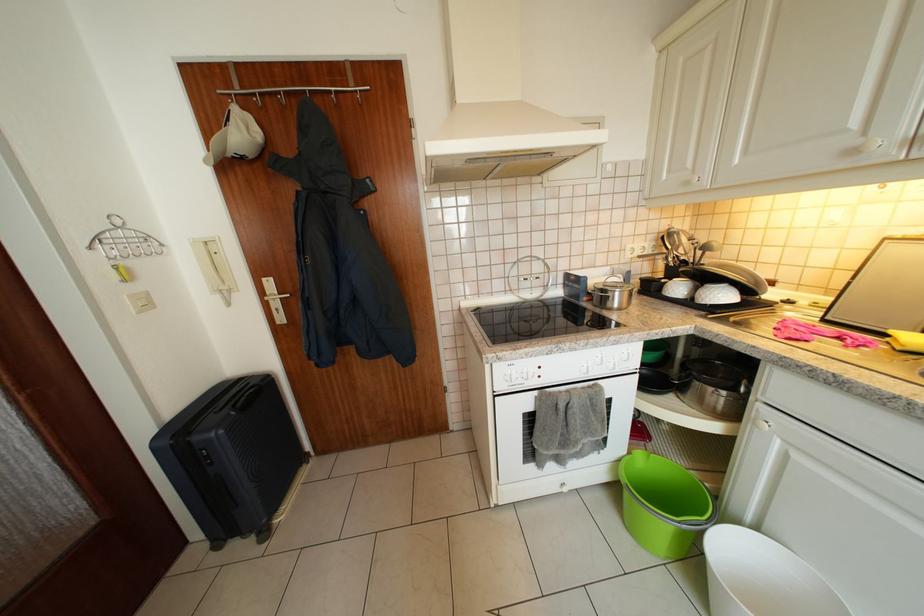
Locate an element on the screen. The width and height of the screenshot is (924, 616). metal cooking pot is located at coordinates (713, 387).